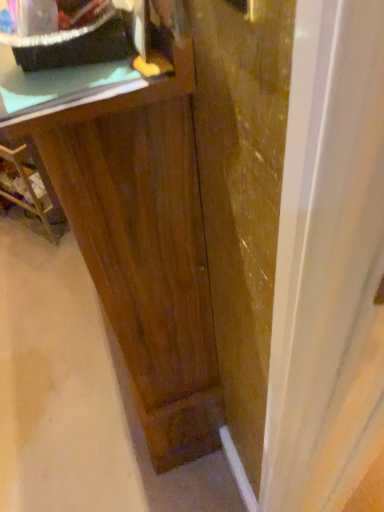
I want to click on free space between dark wood cabinet at left and dark wood vanity at center, so click(x=70, y=312).